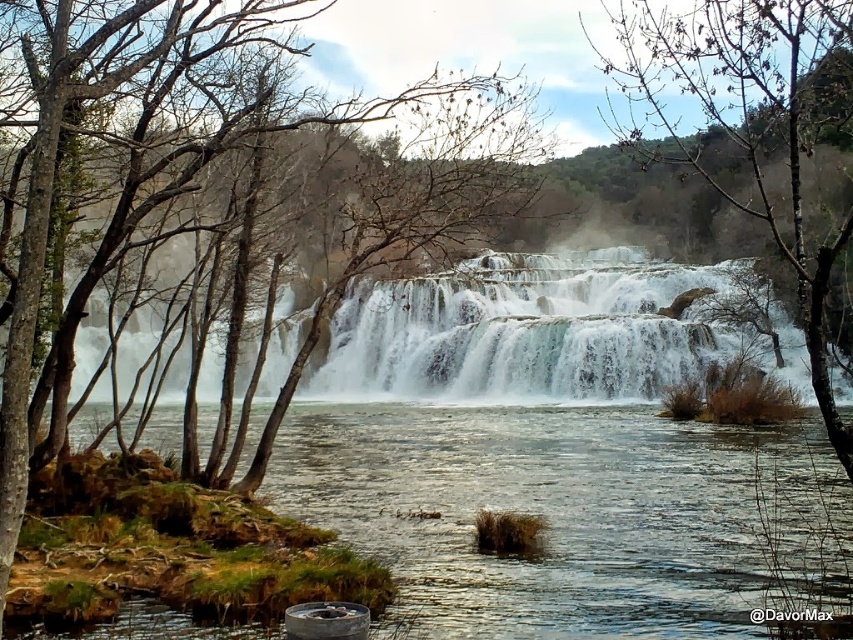
You are an environmental scientist assessing the vegetation in this area. You notice the bare branches at center and the brown bark tree at left. Which tree has a taller structure?

The bare branches at center has a greater height compared to the brown bark tree at left, so the bare branches at center is taller.

You are standing at the edge of the waterfall pool and want to reach a specific point marked at coordinates point (695, 456). If your maximum comfortable walking distance is 60 feet, will you be able to comfortably walk to that point without feeling too far?

The distance of point (695, 456) from viewer is 65.06 feet, which exceeds your maximum comfortable walking distance of 60 feet. Therefore, walking to that point may not be comfortable due to the distance.

You are standing at the edge of the waterfall and see the point labeled as point (526, 330). What type of surface is this point located on?

The point (526, 330) is located on the white frothy water at center, which is part of the cascading waterfall.